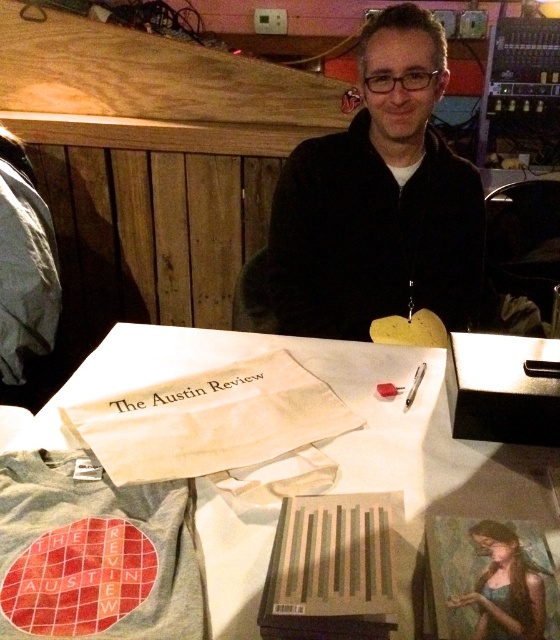
You are organizing a small event and need to place the black matte jacket at center and the white cloth bag at center on a shelf. The shelf is exactly as wide as the jacket. Can both items fit side by side?

The black matte jacket at center might be wider than the white cloth bag at center. Since the shelf is exactly as wide as the jacket, there might not be enough space for both items to fit side by side.

You are organizing items on a table in the image. You need to place a new item between the white cloth bag at center and the oil painting of woman at center. Where should you place it?

The new item should be placed between the white cloth bag at center and the oil painting of woman at center, to the right of the white cloth bag at center and to the left of the oil painting of woman at center since the white cloth bag at center is on the left side of the oil painting of woman at center.

You are organizing a book fair and need to place a name tag on the table. The name tag is 12 inches wide. You have two items on the table, the white fabric bag at center and the oil painting of woman at center. Can you place the name tag between them without overlapping either item?

The white fabric bag at center is 11.42 inches from the oil painting of woman at center. Since the name tag is 12 inches wide, it would overlap both items if placed between them.